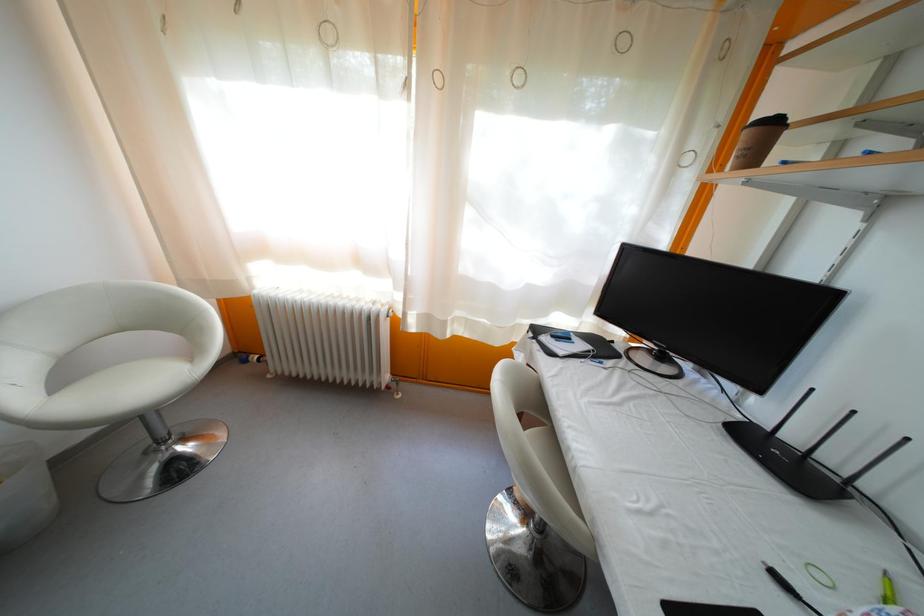
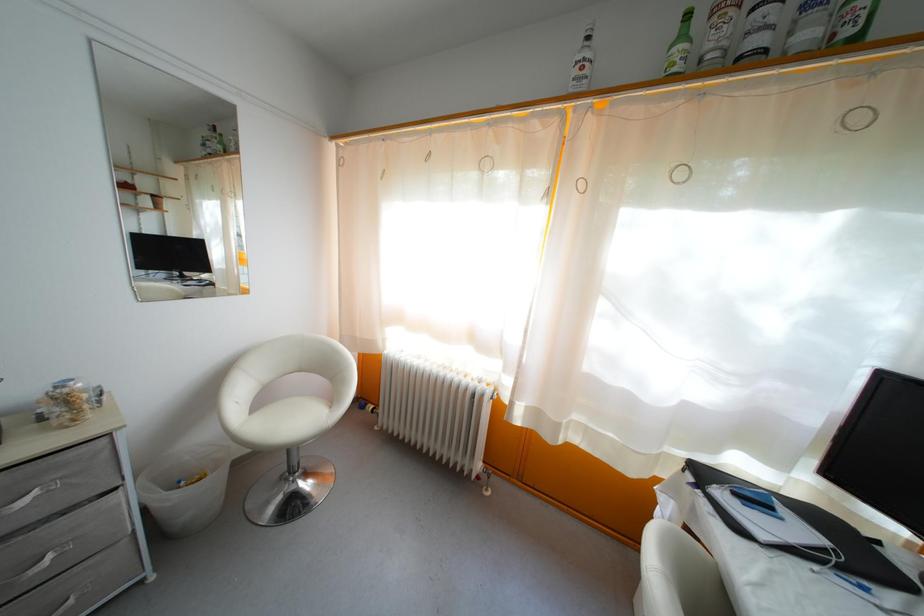
Question: The camera is either moving clockwise (left) or counter-clockwise (right) around the object. The first image is from the beginning of the video and the second image is from the end. Is the camera moving left or right when shooting the video?

Choices:
 (A) Left
 (B) Right

Answer: (B)